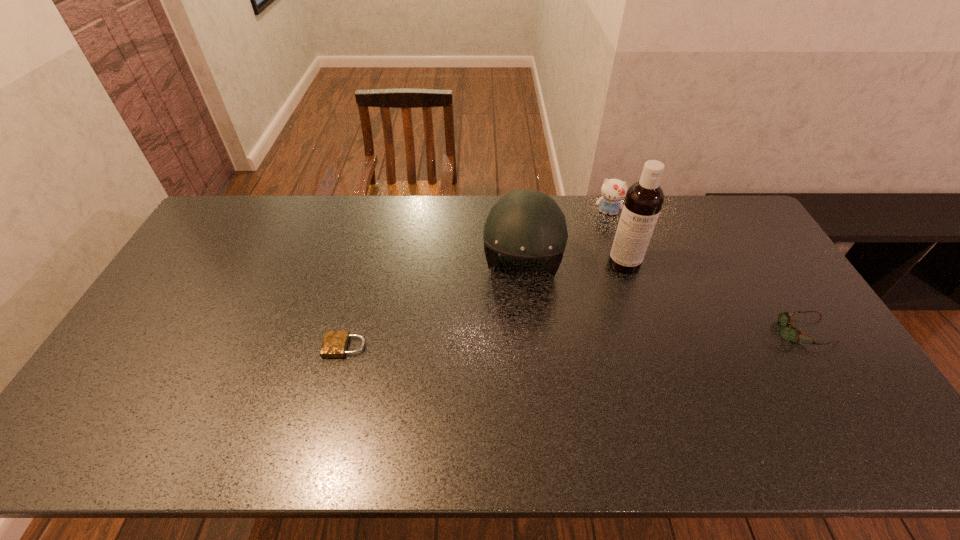
Locate an element on the screen. vacant position located at the face opening of the fourth object from right to left is located at coordinates coord(512,354).

Where is `object present at the far edge`? The height and width of the screenshot is (540, 960). object present at the far edge is located at coordinates [x=613, y=191].

Where is `object at the right edge`? Image resolution: width=960 pixels, height=540 pixels. object at the right edge is located at coordinates (787, 333).

I want to click on vacant space at the far edge of the desktop, so tap(686, 228).

In the image, there is a desktop. Where is `vacant region at the near edge`? This screenshot has width=960, height=540. vacant region at the near edge is located at coordinates (714, 396).

At what (x,y) coordinates should I click in order to perform the action: click on vacant space at the right edge. Please return your answer as a coordinate pair (x, y). The width and height of the screenshot is (960, 540). Looking at the image, I should click on (743, 280).

At what (x,y) coordinates should I click in order to perform the action: click on blank area at the far right corner. Please return your answer as a coordinate pair (x, y). This screenshot has width=960, height=540. Looking at the image, I should click on (711, 211).

At what (x,y) coordinates should I click in order to perform the action: click on unoccupied area between the leftmost object and the dishwasher detergent. Please return your answer as a coordinate pair (x, y). The height and width of the screenshot is (540, 960). Looking at the image, I should click on (485, 305).

The image size is (960, 540). Identify the location of vacant point located between the third shortest object and the leftmost object. (476, 280).

Where is `vacant area that lies between the farthest object and the fourth tallest object`? The width and height of the screenshot is (960, 540). vacant area that lies between the farthest object and the fourth tallest object is located at coordinates (703, 272).